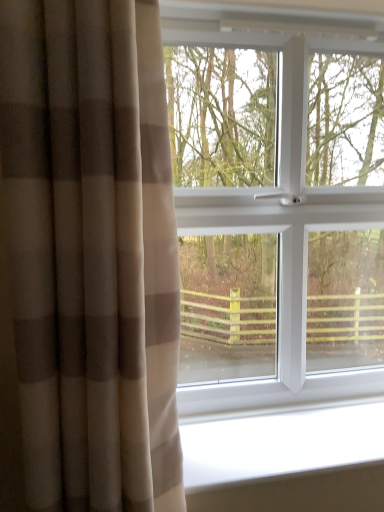
Question: Relative to beige textured curtain at left, is white smooth window sill at lower center in front or behind?

Choices:
 (A) behind
 (B) front

Answer: (A)

Question: Is white smooth window sill at lower center to the left or to the right of beige textured curtain at left in the image?

Choices:
 (A) left
 (B) right

Answer: (B)

Question: Which object is the closest to the beige textured curtain at left?

Choices:
 (A) white smooth window sill at lower center
 (B) white plastic window at center

Answer: (A)

Question: Estimate the real-world distances between objects in this image. Which object is closer to the white plastic window at center?

Choices:
 (A) beige textured curtain at left
 (B) white smooth window sill at lower center

Answer: (B)